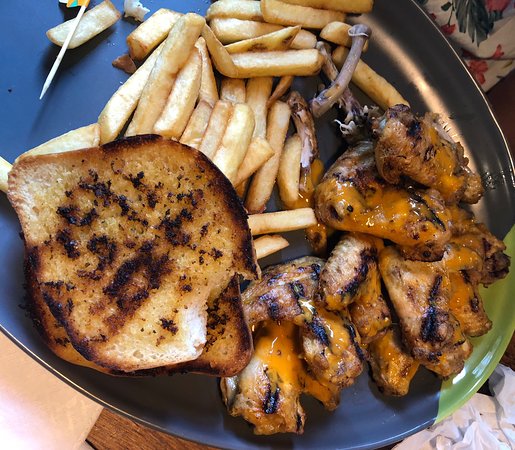
This screenshot has height=450, width=515. In order to click on plate in this screenshot , I will do `click(205, 424)`.